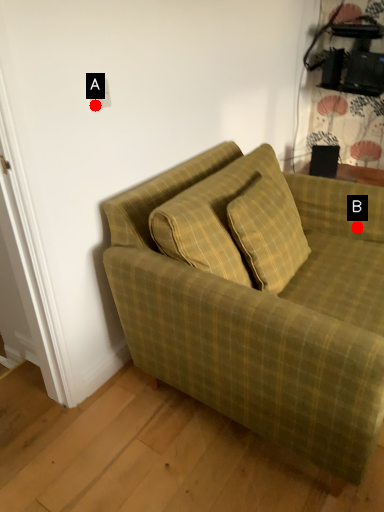
Question: Two points are circled on the image, labeled by A and B beside each circle. Which of the following is the farthest from the observer?

Choices:
 (A) A is further
 (B) B is further

Answer: (B)